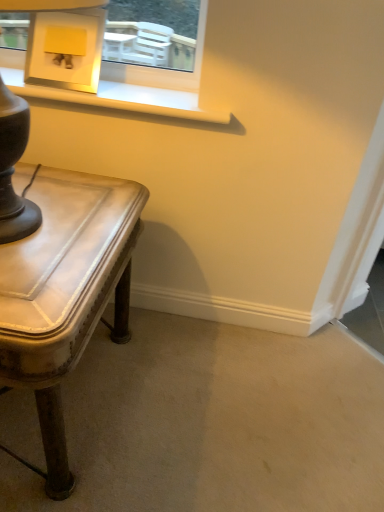
Identify the location of free location above leather-like table at lower left (from a real-world perspective). (53, 212).